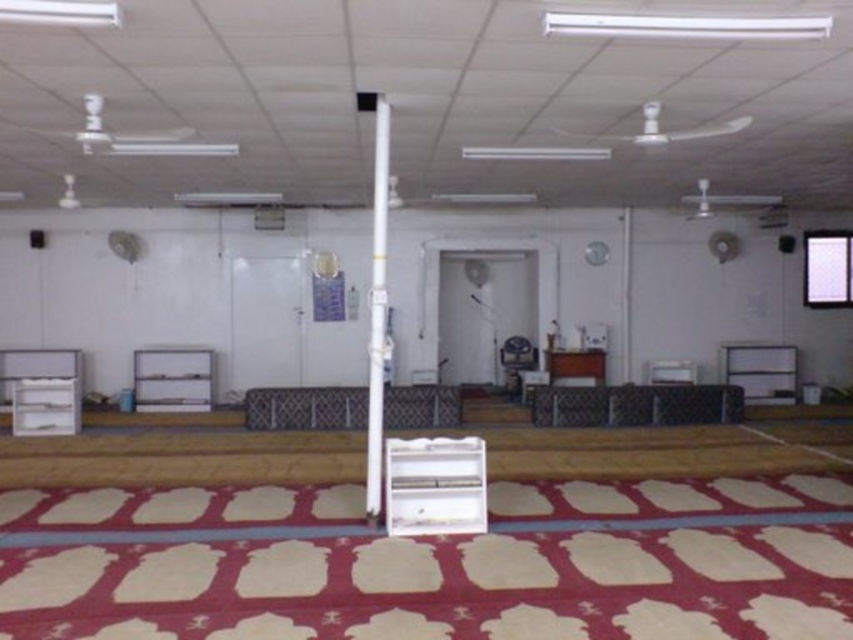
Question: Which object is closer to the camera taking this photo?

Choices:
 (A) white glossy pole at center
 (B) metallic silver bench at center
 (C) metallic chain-link fence at center

Answer: (A)

Question: Which object is the farthest from the metallic silver bench at center?

Choices:
 (A) white glossy pole at center
 (B) metallic chain-link fence at center
 (C) metallic silver chair at center

Answer: (A)

Question: Where is metallic silver bench at center located in relation to white glossy pole at center in the image?

Choices:
 (A) right
 (B) left

Answer: (B)

Question: Is white glossy pole at center wider than metallic silver chair at center?

Choices:
 (A) yes
 (B) no

Answer: (B)

Question: Based on their relative distances, which object is nearer to the metallic chain-link fence at center?

Choices:
 (A) metallic silver chair at center
 (B) metallic silver bench at center
 (C) white glossy pole at center

Answer: (B)

Question: Does metallic silver bench at center have a smaller size compared to metallic silver chair at center?

Choices:
 (A) no
 (B) yes

Answer: (A)